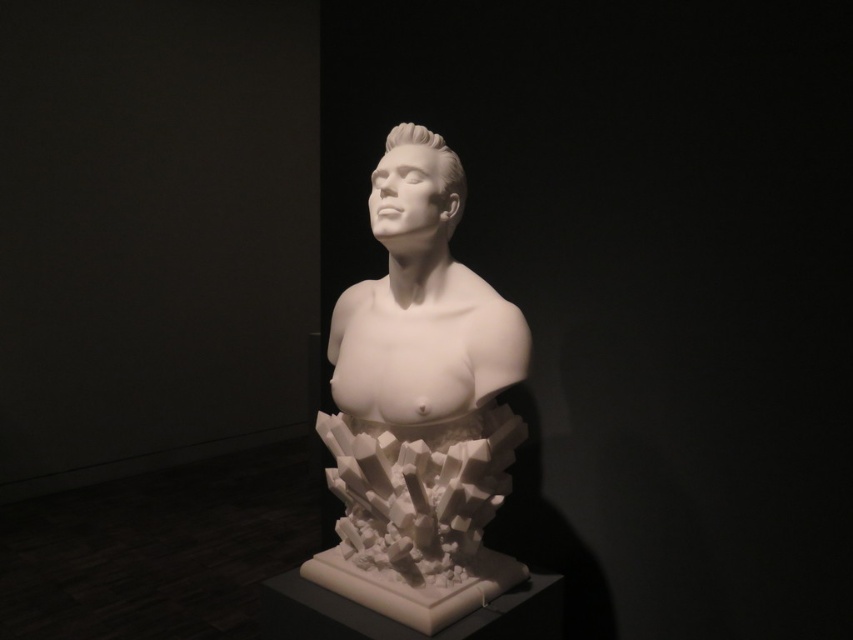
Question: Can you confirm if white marble bust at center is positioned above white glossy head at center?

Choices:
 (A) no
 (B) yes

Answer: (A)

Question: Which of the following is the farthest from the observer?

Choices:
 (A) white glossy head at center
 (B) white marble bust at center

Answer: (A)

Question: Which object is farther from the camera taking this photo?

Choices:
 (A) white marble bust at center
 (B) white glossy head at center

Answer: (B)

Question: Is white marble bust at center bigger than white glossy head at center?

Choices:
 (A) no
 (B) yes

Answer: (B)

Question: Can you confirm if white marble bust at center is smaller than white glossy head at center?

Choices:
 (A) no
 (B) yes

Answer: (A)